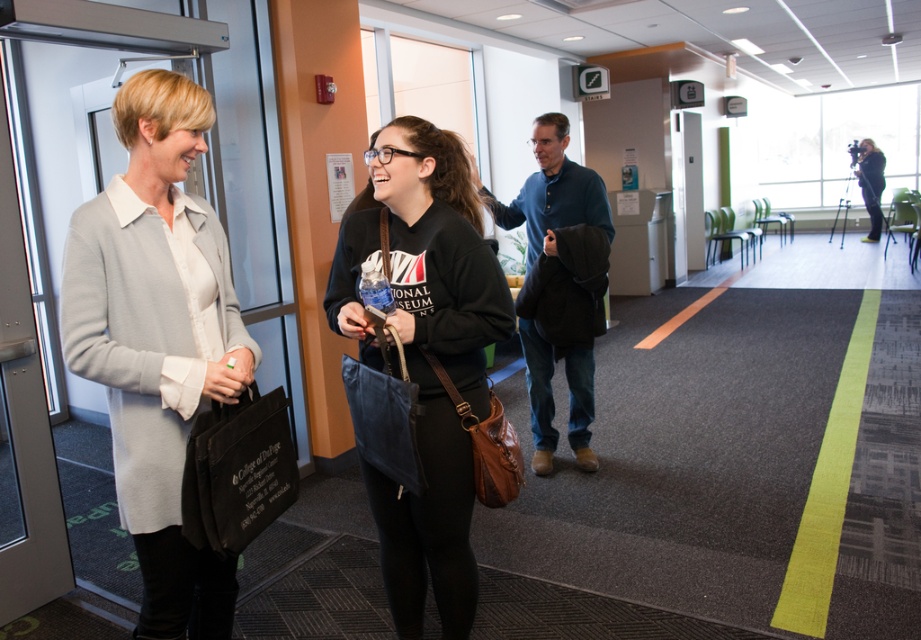
You are standing in the hallway and want to find the light gray sweater at left. According to the coordinates provided, where should you look?

The light gray sweater at left is located at coordinates point (157, 340).

You are a photographer positioned in the hallway and want to capture both the black matte sweatshirt at center and the blue cotton shirt at center in a single photo. Which one should you focus on first to ensure both are in clear focus?

You should focus on the black matte sweatshirt at center first since it is closer to the viewer than the blue cotton shirt at center, ensuring both will be in focus when using a shallow depth of field.

Where is the light gray sweater at left located in the image?

The light gray sweater at left is located at point (157,340).